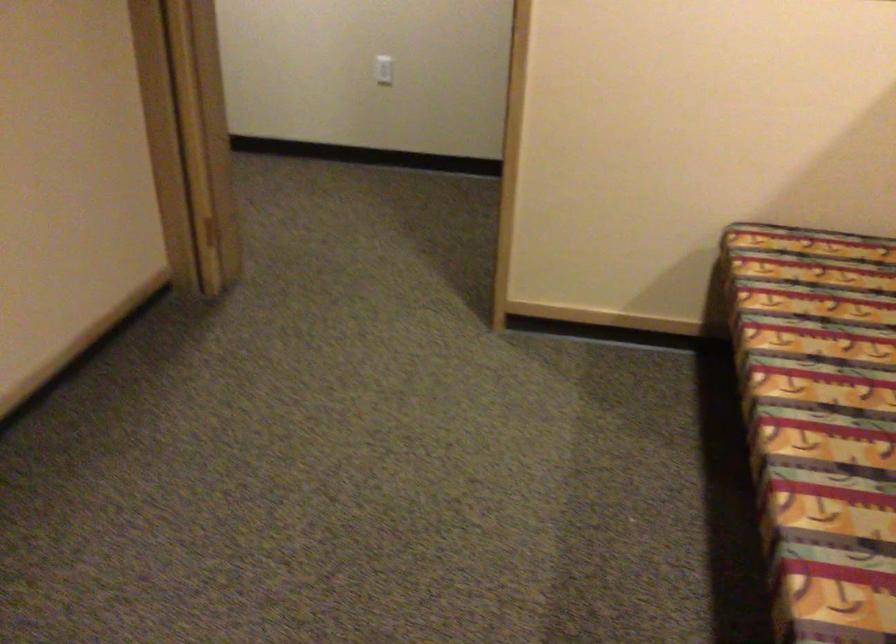
Where is `white electrical outlet`? The image size is (896, 644). white electrical outlet is located at coordinates (383, 70).